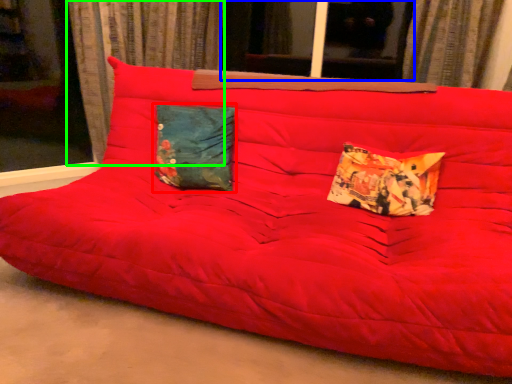
Question: Which object is the farthest from pillow (highlighted by a red box)? Choose among these: window (highlighted by a blue box) or curtain (highlighted by a green box).

Choices:
 (A) window
 (B) curtain

Answer: (A)